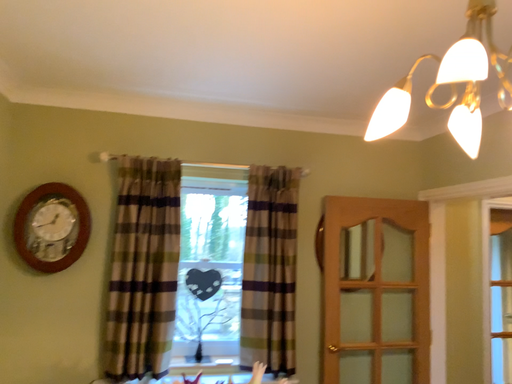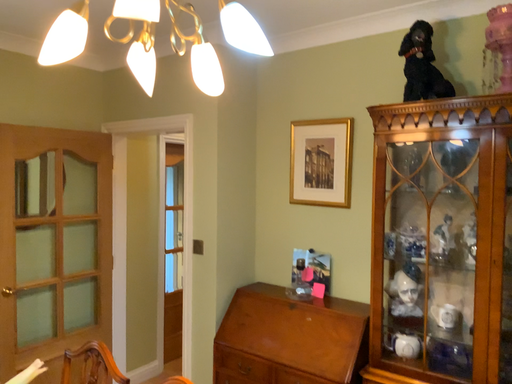
Question: Which way did the camera rotate in the video?

Choices:
 (A) rotated left
 (B) rotated right

Answer: (B)